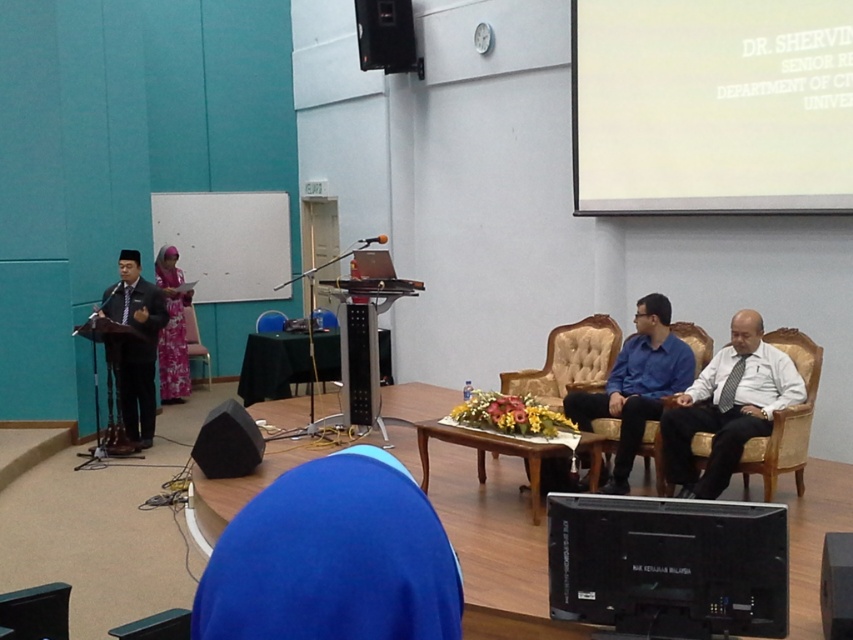
Question: Based on their relative distances, which object is nearer to the black wood speaker at lower right?

Choices:
 (A) dark blue suit at left
 (B) black matte speaker at lower left
 (C) blue fabric at lower center

Answer: (C)

Question: Is white textured shirt at right above black wood speaker at lower right?

Choices:
 (A) yes
 (B) no

Answer: (A)

Question: Does blue fabric at lower center appear on the left side of white textured shirt at right?

Choices:
 (A) yes
 (B) no

Answer: (A)

Question: Which point is closer to the camera?

Choices:
 (A) (375, 54)
 (B) (672, 349)
 (C) (120, 349)
 (D) (277, 556)

Answer: (D)

Question: Is tufted leather armchair at center further to the viewer compared to black leather armchair at lower left?

Choices:
 (A) yes
 (B) no

Answer: (A)

Question: Which object is farther from the camera taking this photo?

Choices:
 (A) brown fabric armchair at center
 (B) tufted leather armchair at center
 (C) black matte speaker at lower left

Answer: (A)